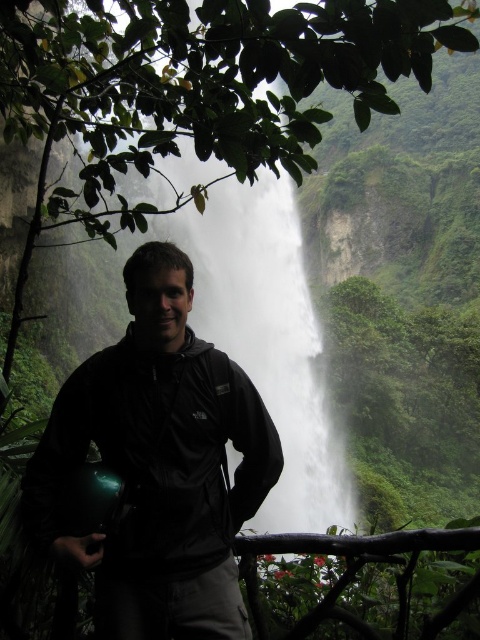
You are a photographer preparing to take a picture of the waterfall. You notice the black matte jacket at center and the brown wooden rail at lower center in your frame. Which object should you adjust your focus to ensure the other is in the background?

You should focus on the black matte jacket at center because it is positioned over the brown wooden rail at lower center, meaning the rail will naturally be in the background if the jacket is in focus.

You are a photographer trying to capture the waterfall. You have a tripod that needs to be placed between the black matte jacket at center and the brown wooden rail at lower center. Is there enough space to position the tripod between them?

The black matte jacket at center is to the left of the brown wooden rail at lower center, so there is space between them to position the tripod.

You are standing at the point where the person is in the image. The white misty waterfall at center is represented by point (x=268, y=339). If you want to move closer to the waterfall, which direction should you move? Please answer with a direction like north, south, east, west, or a combination of those.

The white misty waterfall at center is located at point (x=268, y=339). Since the person is at the origin point, moving towards the center would mean heading in the direction of the waterfall. Therefore, you should move north to get closer to the white misty waterfall at center.